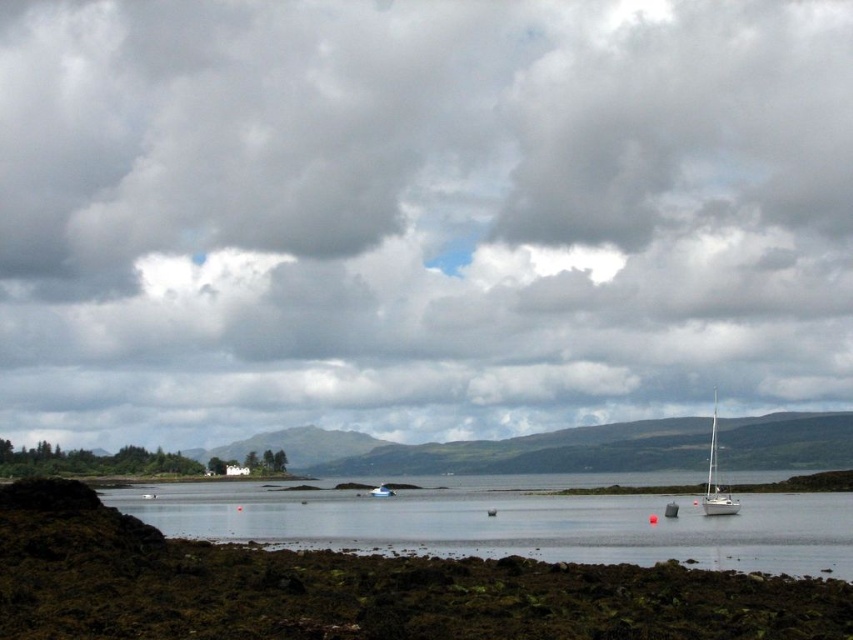
Question: Does cloudy sky at upper center appear on the left side of white glossy sailboat at lower right?

Choices:
 (A) yes
 (B) no

Answer: (A)

Question: From the image, what is the correct spatial relationship of cloudy sky at upper center in relation to white plastic boat at center?

Choices:
 (A) above
 (B) below

Answer: (A)

Question: Which object is closer to the camera taking this photo?

Choices:
 (A) white glossy sailboat at lower right
 (B) clear water at center

Answer: (B)

Question: Does cloudy sky at upper center appear under white plastic boat at center?

Choices:
 (A) no
 (B) yes

Answer: (A)

Question: Which object is closer to the camera taking this photo?

Choices:
 (A) clear water at center
 (B) white plastic boat at center

Answer: (A)

Question: Which object is closer to the camera taking this photo?

Choices:
 (A) white plastic boat at center
 (B) clear water at center
 (C) white glossy sailboat at lower right

Answer: (B)